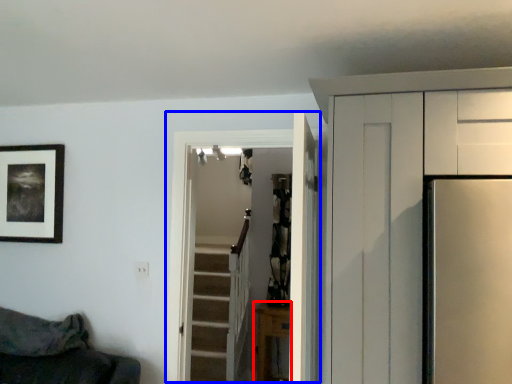
Question: Which point is closer to the camera, furniture (highlighted by a red box) or door (highlighted by a blue box)?

Choices:
 (A) furniture
 (B) door

Answer: (B)